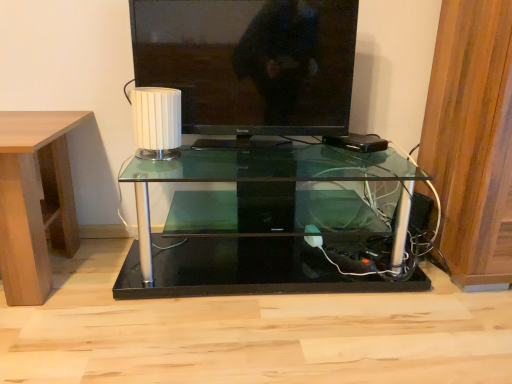
Question: Is light brown wood at left next to white ribbed lampshade at center and touching it?

Choices:
 (A) no
 (B) yes

Answer: (A)

Question: Considering the relative sizes of light brown wood at left and white ribbed lampshade at center in the image provided, is light brown wood at left wider than white ribbed lampshade at center?

Choices:
 (A) no
 (B) yes

Answer: (B)

Question: Is light brown wood at left oriented towards white ribbed lampshade at center?

Choices:
 (A) no
 (B) yes

Answer: (A)

Question: From the image's perspective, is light brown wood at left on top of white ribbed lampshade at center?

Choices:
 (A) yes
 (B) no

Answer: (B)

Question: Is the depth of light brown wood at left greater than that of white ribbed lampshade at center?

Choices:
 (A) yes
 (B) no

Answer: (B)

Question: In terms of height, does matte black television at upper center look taller or shorter compared to white ribbed lampshade at center?

Choices:
 (A) tall
 (B) short

Answer: (A)

Question: From the image's perspective, is matte black television at upper center positioned above or below white ribbed lampshade at center?

Choices:
 (A) above
 (B) below

Answer: (A)

Question: Is matte black television at upper center inside the boundaries of white ribbed lampshade at center, or outside?

Choices:
 (A) outside
 (B) inside

Answer: (A)

Question: From a real-world perspective, is matte black television at upper center physically located above or below white ribbed lampshade at center?

Choices:
 (A) below
 (B) above

Answer: (B)

Question: Does point (16, 291) appear closer or farther from the camera than point (239, 26)?

Choices:
 (A) closer
 (B) farther

Answer: (A)

Question: Which is correct: light brown wood at left is inside matte black television at upper center, or outside of it?

Choices:
 (A) inside
 (B) outside

Answer: (B)

Question: In terms of height, does light brown wood at left look taller or shorter compared to matte black television at upper center?

Choices:
 (A) tall
 (B) short

Answer: (A)

Question: Is light brown wood at left in front of or behind matte black television at upper center in the image?

Choices:
 (A) behind
 (B) front

Answer: (B)

Question: From a real-world perspective, is light brown wood at left physically located above or below transparent glass table at center?

Choices:
 (A) above
 (B) below

Answer: (A)

Question: Is point (73, 238) closer or farther from the camera than point (395, 223)?

Choices:
 (A) farther
 (B) closer

Answer: (B)